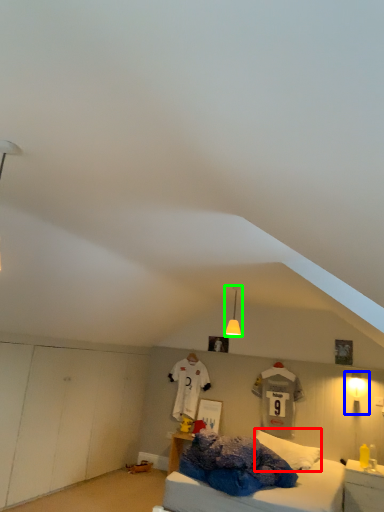
Question: Which object is positioned closest to pillow (highlighted by a red box)? Select from light fixture (highlighted by a blue box) and light fixture (highlighted by a green box).

Choices:
 (A) light fixture
 (B) light fixture

Answer: (B)